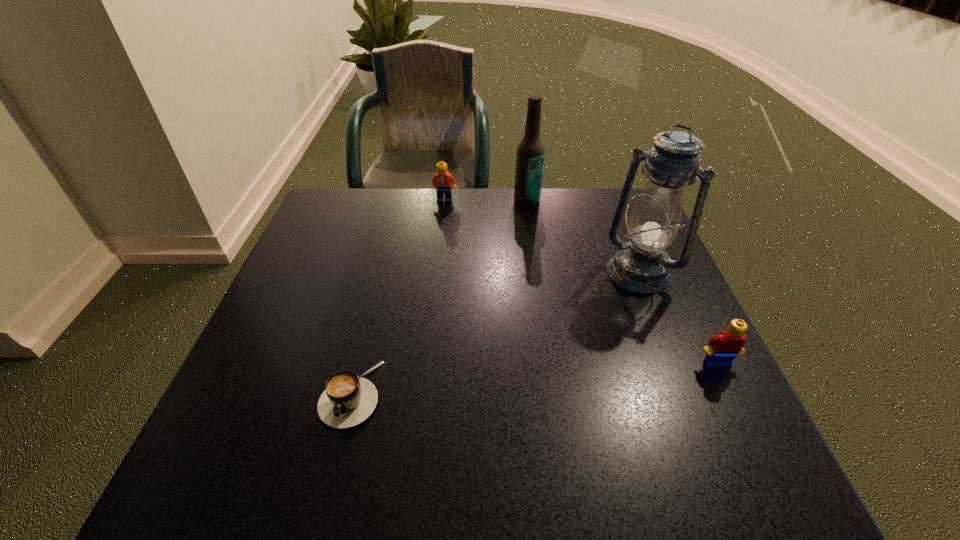
Find the location of a particular element. The image size is (960, 540). cappuccino is located at coordinates (348, 400).

Locate an element on the screen. This screenshot has width=960, height=540. the shortest object is located at coordinates (348, 400).

The width and height of the screenshot is (960, 540). What are the coordinates of `the nearer Lego` in the screenshot? It's located at (722, 349).

Where is `the left Lego`? The image size is (960, 540). the left Lego is located at coordinates (443, 180).

At what (x,y) coordinates should I click in order to perform the action: click on the farther Lego. Please return your answer as a coordinate pair (x, y). The height and width of the screenshot is (540, 960). Looking at the image, I should click on (443, 180).

Identify the location of beer bottle. This screenshot has height=540, width=960. [x=530, y=155].

Locate an element on the screen. Image resolution: width=960 pixels, height=540 pixels. the third object from left to right is located at coordinates (530, 155).

Where is `lantern`? lantern is located at coordinates (641, 265).

Where is `the tallest object`? The height and width of the screenshot is (540, 960). the tallest object is located at coordinates (641, 265).

The width and height of the screenshot is (960, 540). Find the location of `vacant area situated on the front-facing side of the right Lego`. vacant area situated on the front-facing side of the right Lego is located at coordinates (746, 423).